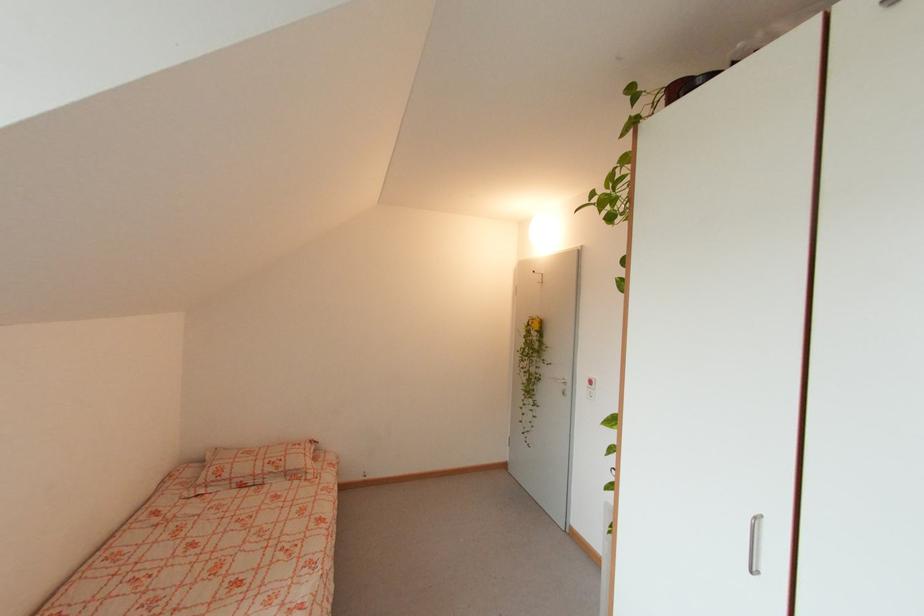
The width and height of the screenshot is (924, 616). What do you see at coordinates (563, 381) in the screenshot?
I see `the door handle` at bounding box center [563, 381].